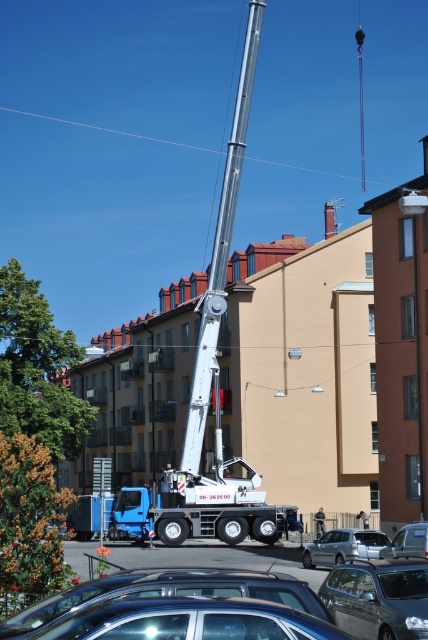
Looking at this image, you are a pedestrian standing on the sidewalk and see both the metallic gray sedan at center and the metallic silver sedan at center. Which one is closer to the white crane truck parked on the street?

The metallic gray sedan at center is closer to the white crane truck parked on the street because it is positioned to the left of the metallic silver sedan at center, and since the crane truck is parked on the street, the sedan closer to the left side would be nearer.

You are a delivery driver who needs to park your vehicle between the metallic silver car at lower center and the metallic gray sedan at center. Given that your vehicle is 4.5 meters long, can you fit your car in the available space between them?

The metallic silver car at lower center is larger than the metallic gray sedan at center, but the exact distance between them is not provided. Without knowing the space between the two cars, it is impossible to determine if your 4.5 meter vehicle can fit.

You are a delivery person needing to park your vehicle between the metallic blue car at lower center and the metallic gray sedan at center. Given that your delivery van is 2 meters wide, can you fit your van between them?

The metallic blue car at lower center is wider than the metallic gray sedan at center. However, the exact distance between them isn not specified in the provided information. Without knowing the space between the two vehicles, it is impossible to determine if the 2 meter wide van can fit.